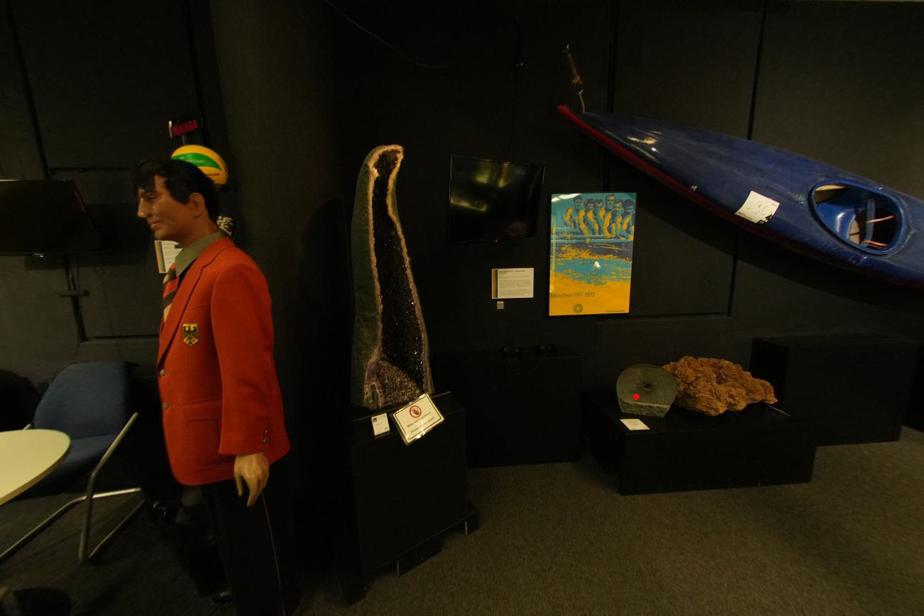
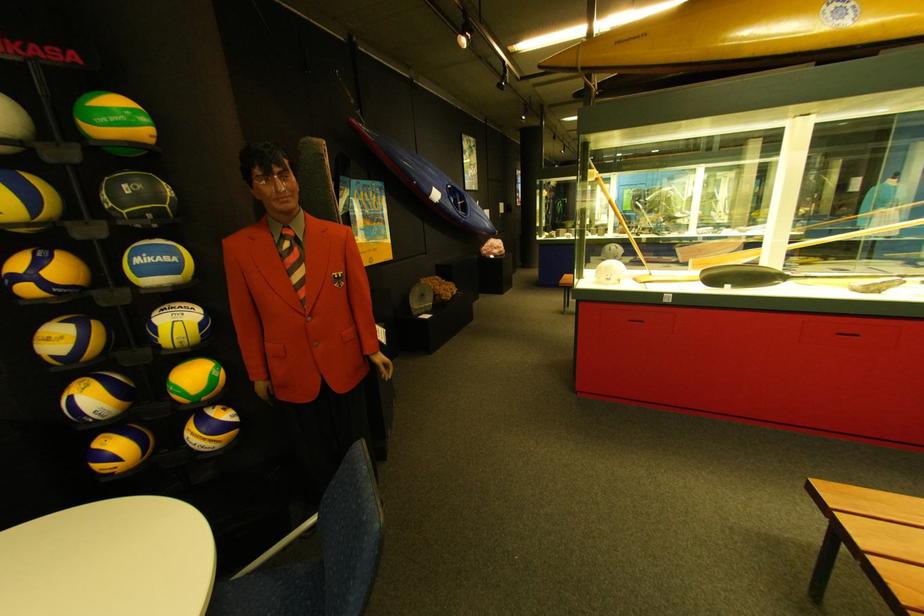
Question: I am providing you with two images of the same scene from different viewpoints. In image1, a red point is highlighted. Considering the same 3D point in image2, which of the following is correct?

Choices:
 (A) It is closer
 (B) It is farther

Answer: (A)